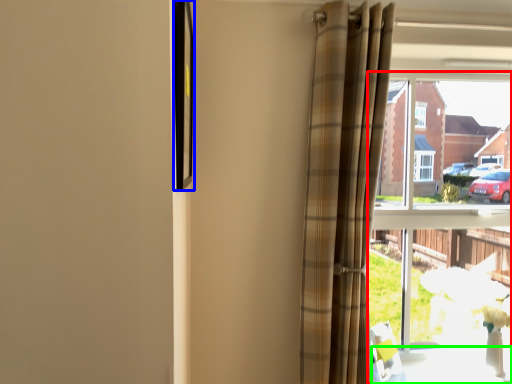
Question: Which object is positioned closest to window (highlighted by a red box)? Select from picture frame (highlighted by a blue box) and table (highlighted by a green box).

Choices:
 (A) picture frame
 (B) table

Answer: (B)